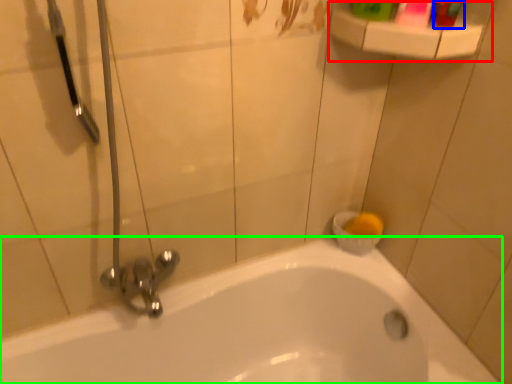
Question: Which object is the farthest from balustrade (highlighted by a red box)? Choose among these: toiletry (highlighted by a blue box) or bathtub (highlighted by a green box).

Choices:
 (A) toiletry
 (B) bathtub

Answer: (B)